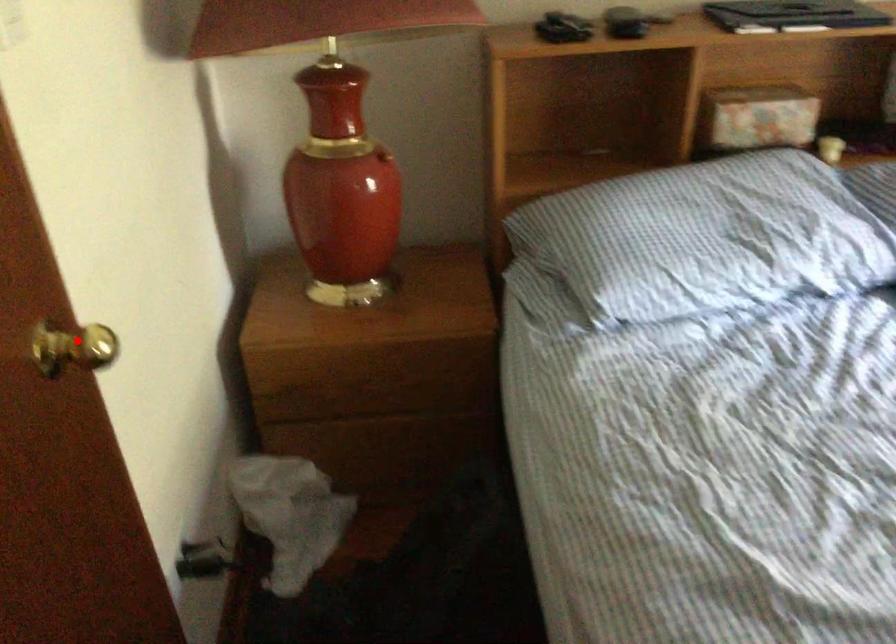
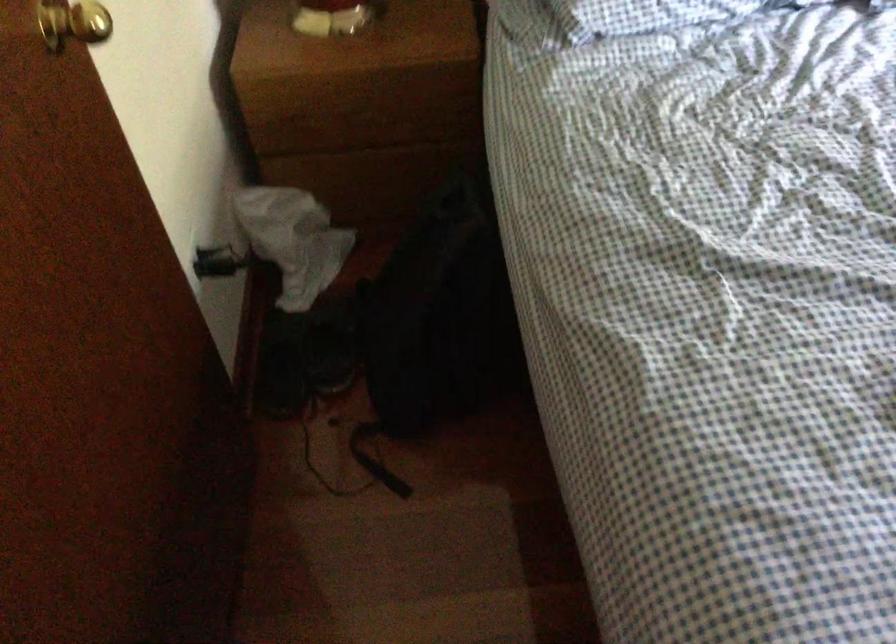
Where in the second image is the point corresponding to the highlighted location from the first image?

(73, 23)